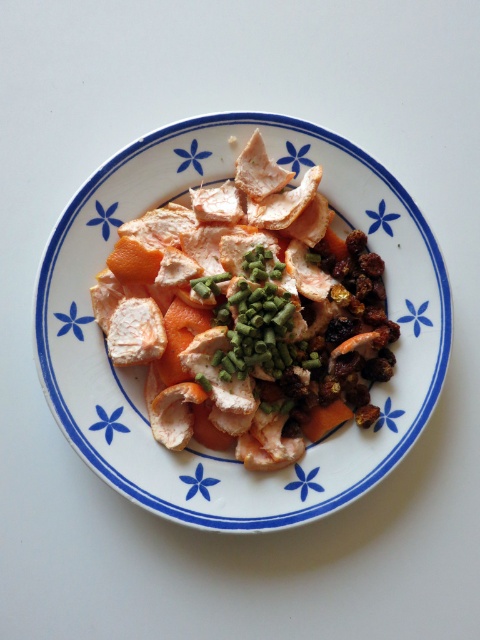
Question: Is orange peel at center to the right of green chopped onion at center from the viewer's perspective?

Choices:
 (A) no
 (B) yes

Answer: (A)

Question: Can you confirm if orange peel at center is thinner than green chopped onion at center?

Choices:
 (A) yes
 (B) no

Answer: (B)

Question: Which point is farther from the camera taking this photo?

Choices:
 (A) (256, 291)
 (B) (295, 204)

Answer: (B)

Question: Does orange peel at center have a lesser width compared to green chopped onion at center?

Choices:
 (A) no
 (B) yes

Answer: (A)

Question: Which point is farther from the camera taking this photo?

Choices:
 (A) pos(236,349)
 (B) pos(254,164)

Answer: (B)

Question: Among these objects, which one is farthest from the camera?

Choices:
 (A) green chopped onion at center
 (B) orange peel at center

Answer: (B)